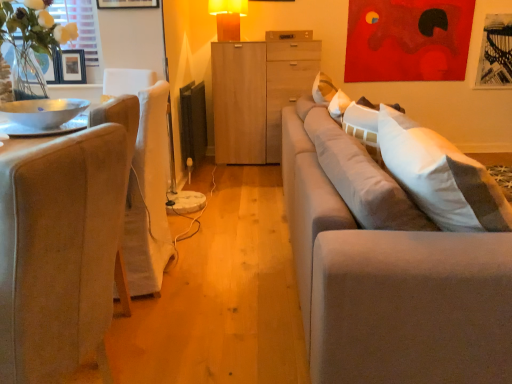
Where is `metallic silver bowl at left`? metallic silver bowl at left is located at coordinates (42, 112).

Identify the location of beige fabric chair at left. (59, 252).

Measure the distance between point (103, 292) and camera.

A distance of 3.65 feet exists between point (103, 292) and camera.

This screenshot has height=384, width=512. Describe the element at coordinates (257, 95) in the screenshot. I see `light wood cabinet at center` at that location.

At what (x,y) coordinates should I click in order to perform the action: click on wooden picture frame at upper left. Please return your answer as a coordinate pair (x, y). Looking at the image, I should click on (72, 67).

Find the location of `wooden drawer at center`. wooden drawer at center is located at coordinates [289, 35].

Where is `metallic silver bowl at left`? The height and width of the screenshot is (384, 512). metallic silver bowl at left is located at coordinates (42, 112).

Is metallic silver bowl at left situated inside matte yellow plastic table lamp at upper center or outside?

metallic silver bowl at left is not inside matte yellow plastic table lamp at upper center, it's outside.

From the picture: Is metallic silver bowl at left thinner than matte yellow plastic table lamp at upper center?

No, metallic silver bowl at left is not thinner than matte yellow plastic table lamp at upper center.

Is point (2, 112) positioned behind point (234, 30)?

No, (2, 112) is in front of (234, 30).

From a real-world perspective, is metallic silver bowl at left located higher than matte yellow plastic table lamp at upper center?

No, from a real-world perspective, metallic silver bowl at left is not above matte yellow plastic table lamp at upper center.

Is matte yellow plastic table lamp at upper center behind light wood cabinet at center?

No, matte yellow plastic table lamp at upper center is closer to the camera.

Based on the photo, how much distance is there between matte yellow plastic table lamp at upper center and light wood cabinet at center?

matte yellow plastic table lamp at upper center is 23.28 inches away from light wood cabinet at center.

What's the angular difference between matte yellow plastic table lamp at upper center and light wood cabinet at center's facing directions?

The angle between the facing direction of matte yellow plastic table lamp at upper center and the facing direction of light wood cabinet at center is 42.3 degrees.

Does matte yellow plastic table lamp at upper center touch light wood cabinet at center?

matte yellow plastic table lamp at upper center and light wood cabinet at center are clearly separated.

Which is in front, white fabric window screen at upper left or wooden drawer at center?

white fabric window screen at upper left is closer to the camera.

From the image's perspective, relative to wooden drawer at center, is white fabric window screen at upper left above or below?

white fabric window screen at upper left is below wooden drawer at center.

How distant is white fabric window screen at upper left from wooden drawer at center?

white fabric window screen at upper left and wooden drawer at center are 1.61 meters apart from each other.

Between white fabric window screen at upper left and wooden drawer at center, which one has smaller size?

wooden drawer at center is smaller.

Locate an element on the screen. picture frame on the left of matte yellow plastic table lamp at upper center is located at coordinates (x=72, y=67).

From a real-world perspective, is matte yellow plastic table lamp at upper center physically located above or below wooden picture frame at upper left?

matte yellow plastic table lamp at upper center is situated higher than wooden picture frame at upper left in the real world.

From the image's perspective, is matte yellow plastic table lamp at upper center positioned above or below wooden picture frame at upper left?

Clearly, from the image's perspective, matte yellow plastic table lamp at upper center is above wooden picture frame at upper left.

Between white fabric window screen at upper left and beige fabric chair at left, which one has less height?

white fabric window screen at upper left is shorter.

Based on the photo, from a real-world perspective, is white fabric window screen at upper left positioned under beige fabric chair at left based on gravity?

No.

Is white fabric window screen at upper left facing towards beige fabric chair at left?

Yes, white fabric window screen at upper left is aimed at beige fabric chair at left.

Which is more to the left, white fabric window screen at upper left or beige fabric chair at left?

white fabric window screen at upper left.

Is white fabric window screen at upper left shorter than matte yellow plastic table lamp at upper center?

Incorrect, the height of white fabric window screen at upper left does not fall short of that of matte yellow plastic table lamp at upper center.

Between white fabric window screen at upper left and matte yellow plastic table lamp at upper center, which one is positioned in front?

Positioned in front is white fabric window screen at upper left.

At what (x,y) coordinates should I click in order to perform the action: click on table lamp behind the white fabric window screen at upper left. Please return your answer as a coordinate pair (x, y). Looking at the image, I should click on (228, 18).

From a real-world perspective, is white fabric window screen at upper left positioned under matte yellow plastic table lamp at upper center based on gravity?

Correct, in the physical world, white fabric window screen at upper left is lower than matte yellow plastic table lamp at upper center.

Who is smaller, wooden drawer at center or light gray fabric couch at right?

wooden drawer at center.

From the image's perspective, which is below, wooden drawer at center or light gray fabric couch at right?

light gray fabric couch at right, from the image's perspective.

Is wooden drawer at center further to camera compared to light gray fabric couch at right?

Yes.

Identify the location of bowl below the matte yellow plastic table lamp at upper center (from the image's perspective). The height and width of the screenshot is (384, 512). (42, 112).

Identify the location of table lamp located above the light wood cabinet at center (from the image's perspective). The height and width of the screenshot is (384, 512). (228, 18).

From the image, which object appears to be farther from white fabric window screen at upper left, matte yellow plastic table lamp at upper center or beige fabric chair at left?

beige fabric chair at left lies further to white fabric window screen at upper left than the other object.

Based on the photo, considering their positions, is wooden picture frame at upper left positioned further to beige fabric chair at left than light gray fabric couch at right?

Based on the image, wooden picture frame at upper left appears to be further to beige fabric chair at left.

Based on their spatial positions, is beige fabric chair at left or wooden picture frame at upper left closer to matte yellow plastic table lamp at upper center?

Based on the image, wooden picture frame at upper left appears to be nearer to matte yellow plastic table lamp at upper center.

Looking at the image, which one is located further to beige fabric chair at left, white fabric window screen at upper left or light gray fabric couch at right?

white fabric window screen at upper left lies further to beige fabric chair at left than the other object.

Looking at the image, which one is located closer to white fabric window screen at upper left, matte yellow plastic table lamp at upper center or light gray fabric couch at right?

matte yellow plastic table lamp at upper center is positioned closer to the anchor white fabric window screen at upper left.

Considering their positions, is light gray fabric couch at right positioned closer to matte yellow plastic table lamp at upper center than white fabric window screen at upper left?

Among the two, white fabric window screen at upper left is located nearer to matte yellow plastic table lamp at upper center.

Considering their positions, is wooden drawer at center positioned further to matte yellow plastic table lamp at upper center than wooden picture frame at upper left?

wooden picture frame at upper left lies further to matte yellow plastic table lamp at upper center than the other object.

Which object lies nearer to the anchor point wooden picture frame at upper left, matte yellow plastic table lamp at upper center or light wood cabinet at center?

The object closer to wooden picture frame at upper left is matte yellow plastic table lamp at upper center.

Image resolution: width=512 pixels, height=384 pixels. I want to click on window screen positioned between light gray fabric couch at right and wooden drawer at center from near to far, so click(83, 32).

Where is `table lamp situated between white fabric window screen at upper left and wooden drawer at center from left to right`? table lamp situated between white fabric window screen at upper left and wooden drawer at center from left to right is located at coordinates (228, 18).

What are the coordinates of `table lamp between white fabric window screen at upper left and light wood cabinet at center` in the screenshot? It's located at (228, 18).

Where is `cabinetry between metallic silver bowl at left and wooden drawer at center from front to back`? The width and height of the screenshot is (512, 384). cabinetry between metallic silver bowl at left and wooden drawer at center from front to back is located at coordinates (257, 95).